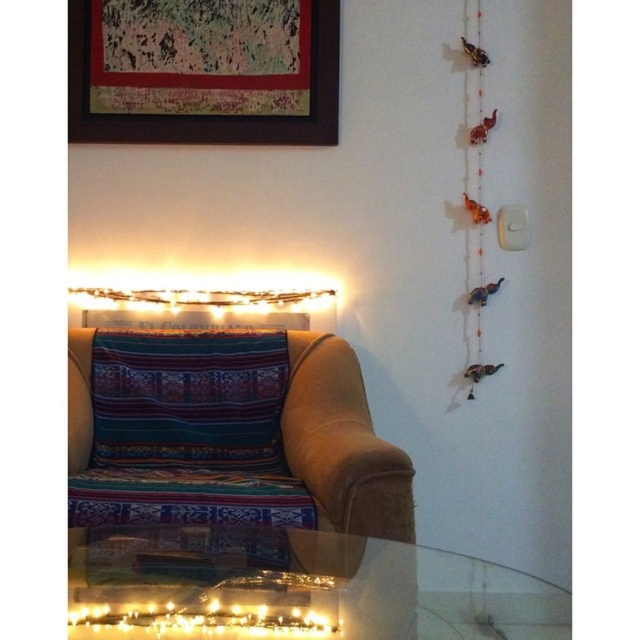
You are standing in the room and want to place a new decorative item on the floor near the textured woven pillow at center. Where should you place it to ensure it is directly to the right of the pillow?

Place the new decorative item at point (188,400) to the right of the textured woven pillow at center.

You are standing in the room and see two points marked in the image. The first point is at coordinate point (x=202, y=468) and the second is at point (x=381, y=460). Which point is closer to you?

Point (x=202, y=468) is further to the camera than point (x=381, y=460), so the second point is closer to you.